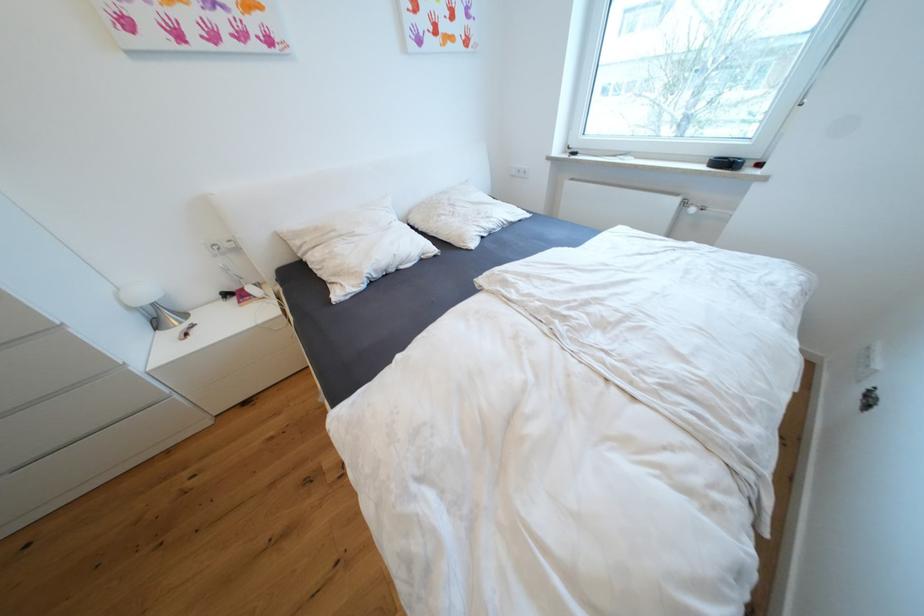
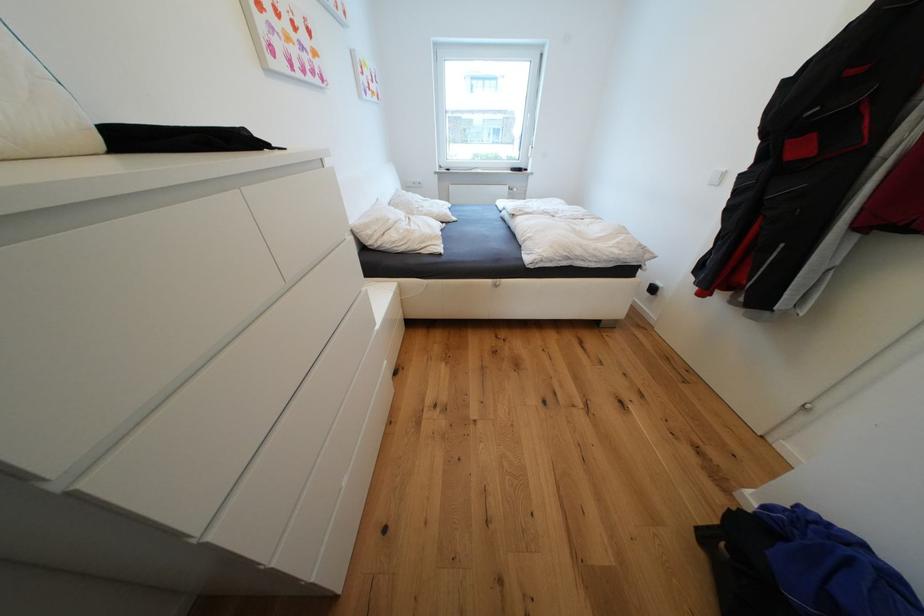
In the second image, find the point that corresponds to (x=512, y=283) in the first image.

(528, 212)